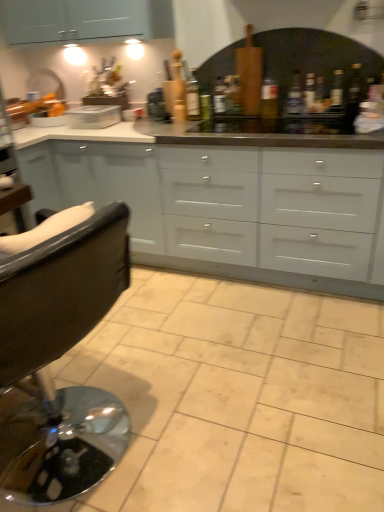
The image size is (384, 512). Find the location of `vacant area in front of matte glass bottle at center, marked as the third bottle in a left-to-right arrangement`. vacant area in front of matte glass bottle at center, marked as the third bottle in a left-to-right arrangement is located at coordinates (266, 122).